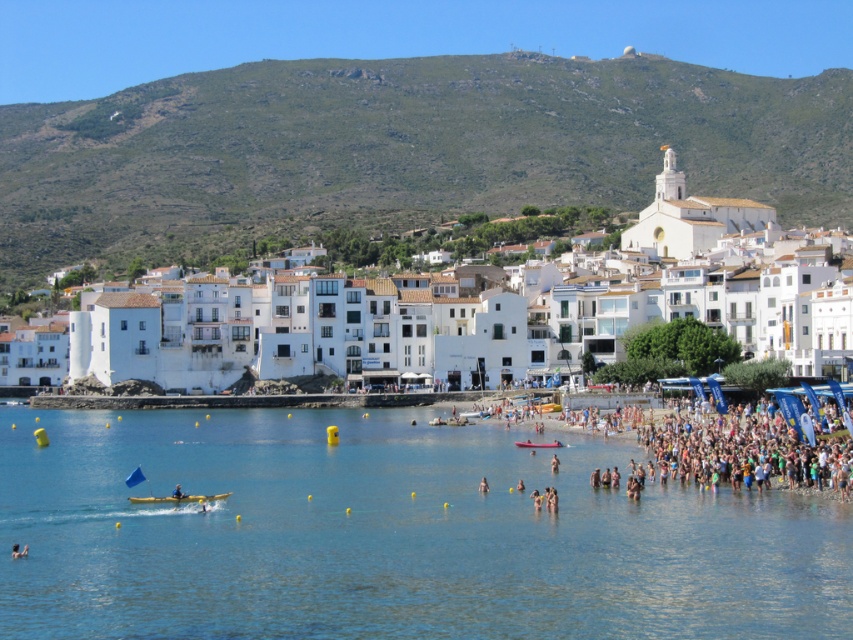
Question: Which point is closer to the camera taking this photo?

Choices:
 (A) (323, 438)
 (B) (480, 488)

Answer: (B)

Question: Does clear blue water at center have a larger size compared to pink rubber boat at center?

Choices:
 (A) no
 (B) yes

Answer: (B)

Question: Does pink rubber boat at center lie in front of smooth skin person at lower left?

Choices:
 (A) no
 (B) yes

Answer: (A)

Question: From the image, what is the correct spatial relationship of white plastic kayak at center in relation to pink rubber boat at center?

Choices:
 (A) above
 (B) below

Answer: (B)

Question: Which object is farther from the camera taking this photo?

Choices:
 (A) skinny person at lower center
 (B) white plastic kayak at center

Answer: (A)

Question: Among these objects, which one is farthest from the camera?

Choices:
 (A) pink rubber boat at center
 (B) white plastic kayak at center
 (C) white matte buildings at center

Answer: (C)